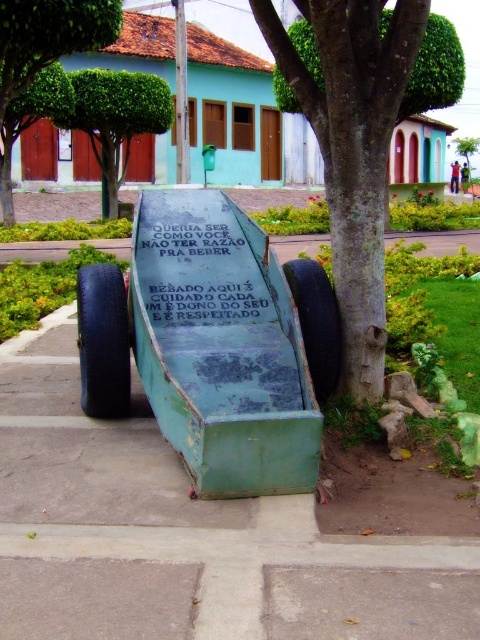
You are a tourist in the town square and want to take a photo of the green painted metal sign at center and the rubber tire at lower center. To ensure both are in the frame, should you position yourself to the left or right side of the installation?

You should position yourself to the right side of the installation because the green painted metal sign at center is to the left of the rubber tire at lower center. By standing to the right, both objects will be visible in the photo.

Consider the image. You are a delivery person with a cart that has a 10 meter battery range. You are at the green painted wood cart at center and need to deliver a package to the green leafy tree at upper center. Can your cart reach there without needing a recharge?

The distance between the green painted wood cart at center and the green leafy tree at upper center is 9.81 meters, which is within the 10 meter battery range. Therefore, the cart can reach the destination without needing a recharge.

What is the object located at the coordinates point (200, 275)?

The point (200, 275) marks the green painted metal sign at center.